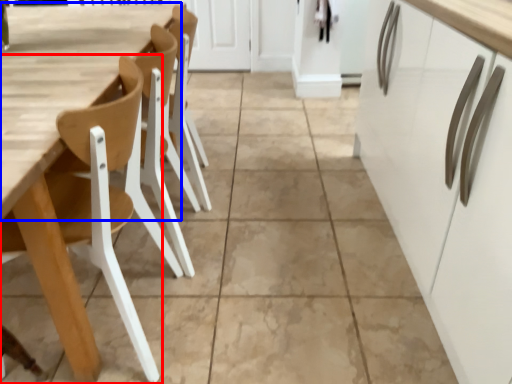
Question: Among these objects, which one is farthest to the camera, chair (highlighted by a red box) or table (highlighted by a blue box)?

Choices:
 (A) chair
 (B) table

Answer: (B)